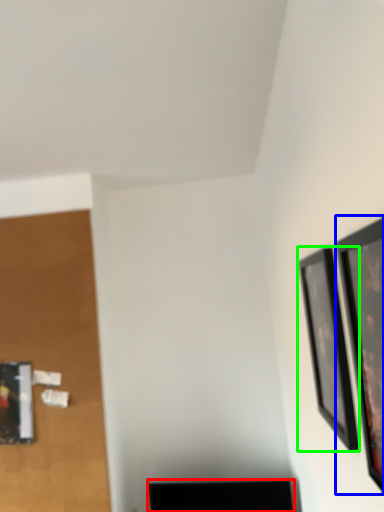
Question: Based on their relative distances, which object is farther from furniture (highlighted by a red box)? Choose from picture frame (highlighted by a blue box) and picture frame (highlighted by a green box).

Choices:
 (A) picture frame
 (B) picture frame

Answer: (A)